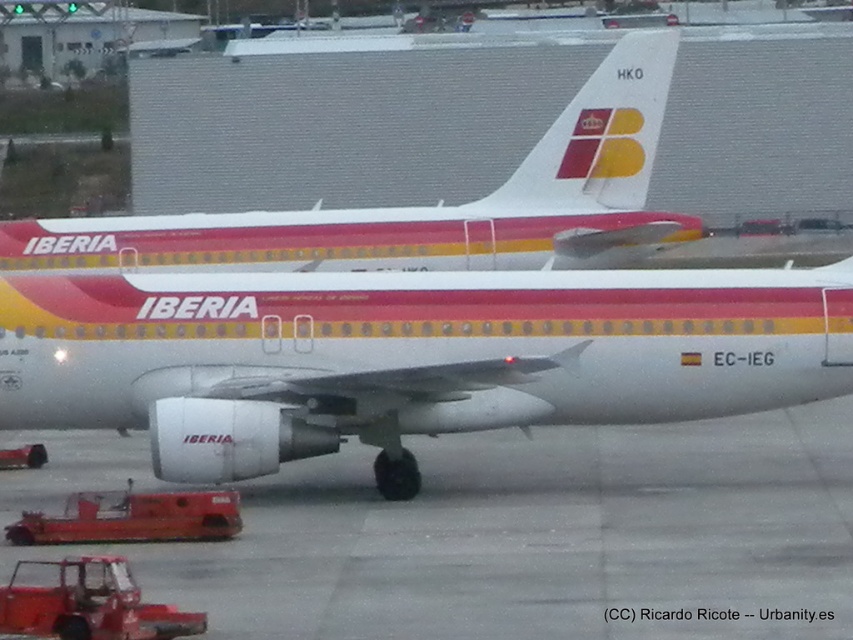
Question: Can you confirm if white smooth tarmac at center is thinner than white glossy airplane at center?

Choices:
 (A) yes
 (B) no

Answer: (A)

Question: Which object is positioned closest to the white textured tail at center?

Choices:
 (A) white smooth tarmac at center
 (B) white glossy airplane at center
 (C) white matte airplane at center

Answer: (B)

Question: Among these points, which one is farthest from the camera?

Choices:
 (A) tap(584, 100)
 (B) tap(131, 227)

Answer: (B)

Question: Estimate the real-world distances between objects in this image. Which object is farther from the white smooth tarmac at center?

Choices:
 (A) white glossy airplane at center
 (B) white textured tail at center

Answer: (B)

Question: Does white matte airplane at center have a greater width compared to white glossy airplane at center?

Choices:
 (A) yes
 (B) no

Answer: (B)

Question: Is white smooth tarmac at center bigger than white textured tail at center?

Choices:
 (A) yes
 (B) no

Answer: (A)